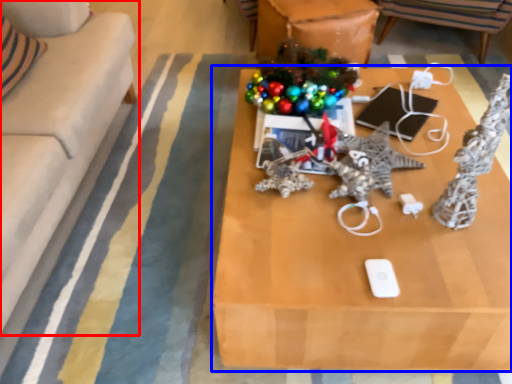
Question: Among these objects, which one is nearest to the camera, studio couch (highlighted by a red box) or table (highlighted by a blue box)?

Choices:
 (A) studio couch
 (B) table

Answer: (A)